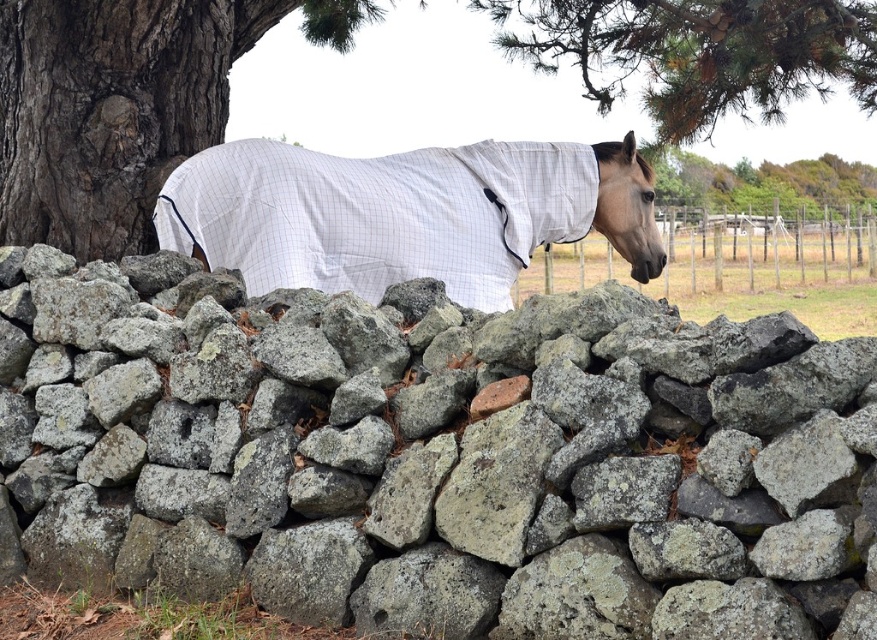
In the scene shown: You are a gardener who wants to place a decorative item between the gray rough stone at center and the green pine needles at upper center. Which object should you place the item closer to if you want it to be near the narrower object?

The gray rough stone at center has a smaller width than the green pine needles at upper center, so you should place the item closer to the gray rough stone at center to be near the narrower object.

You are standing in front of the stone wall in the image. There is a gray rough stone at center located at point [437,458]. If you want to place a small potted plant exactly at this point, will it fit without overlapping any other stones?

The gray rough stone at center is located at point [437,458]. Since the description specifies that this exact point has the gray rough stone, placing a potted plant there would overlap with the stone, so it won

In the scene shown: You are standing in a field and see the gray rough stone at center. You want to place a small garden gnome exactly 3 meters away from the stone. Is the gnome within the field or outside the field?

The gray rough stone at center is 2.91 meters away from the viewer. If you place the gnome 3 meters away from the stone, it would be 2.91 meters plus 3 meters, totaling 5.91 meters from the viewer. Since the field extends beyond the stone, the gnome would likely be within the field unless there are obstacles not shown in the scene.